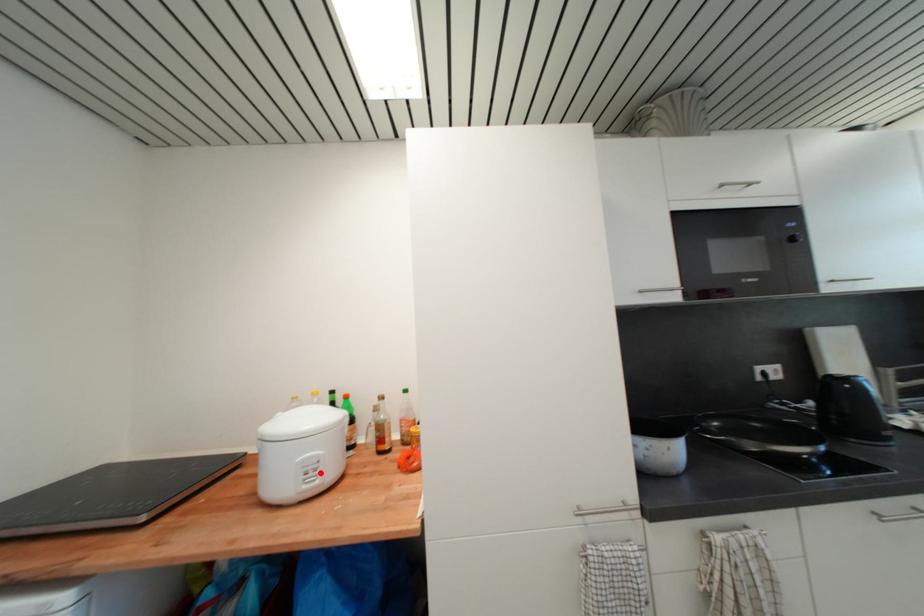
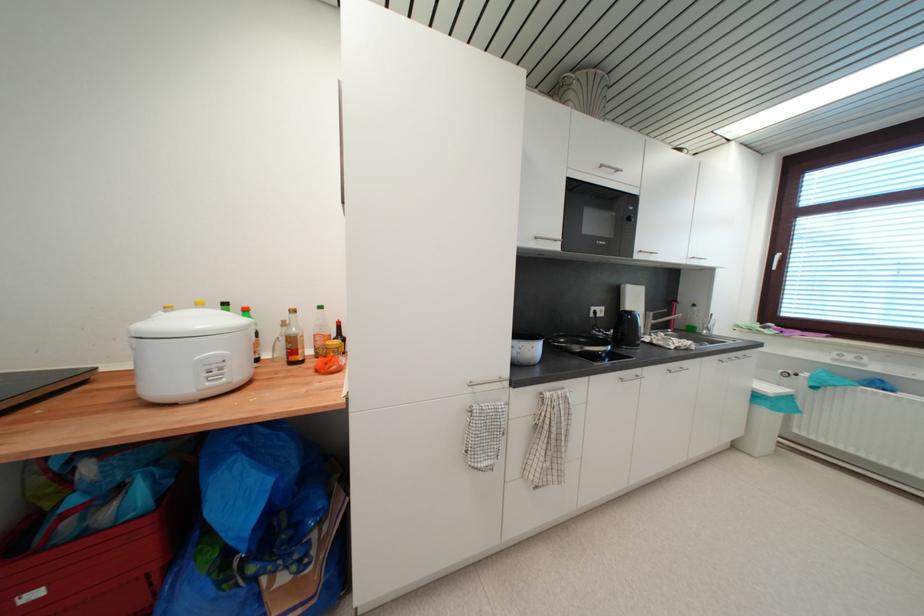
Where in the second image is the point corresponding to the highlighted location from the first image?

(225, 371)